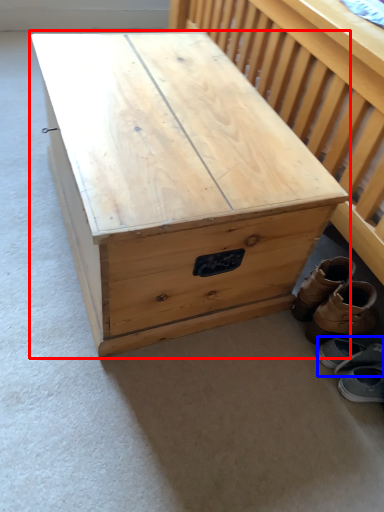
Question: Which object appears farthest to the camera in this image, table (highlighted by a red box) or footwear (highlighted by a blue box)?

Choices:
 (A) table
 (B) footwear

Answer: (B)